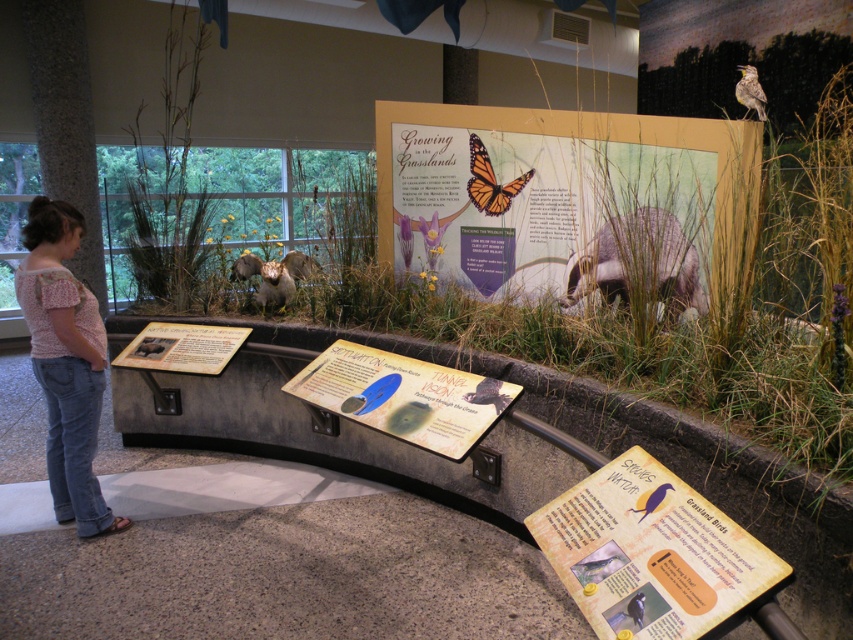
Question: Which point is farther from the camera taking this photo?

Choices:
 (A) (662, 253)
 (B) (524, 276)

Answer: (B)

Question: Which is farther from the orange paper poster at center?

Choices:
 (A) wooden signboard at center
 (B) fuzzy brown badger at center-right
 (C) pink cotton shirt at left

Answer: (C)

Question: Which object appears farthest from the camera in this image?

Choices:
 (A) shiny metallic dragonfly at center
 (B) wooden signboard at center

Answer: (A)

Question: Is matte cardboard signboard at center to the right of orange paper poster at center from the viewer's perspective?

Choices:
 (A) no
 (B) yes

Answer: (A)

Question: Observing the image, what is the correct spatial positioning of matte cardboard signboard at center in reference to wooden signboard at center?

Choices:
 (A) above
 (B) below

Answer: (A)

Question: Can you confirm if pink cotton shirt at left is bigger than fuzzy brown badger at center-right?

Choices:
 (A) yes
 (B) no

Answer: (A)